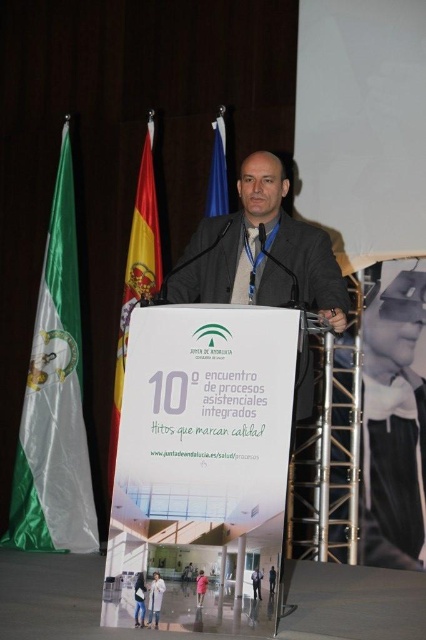
You are attending a formal event and notice a point marked at coordinates [218,170] on the image. Based on the scene description, what object is located at this point?

The point at coordinates [218,170] corresponds to the blue fabric flag at upper center.

In the scene shown: You are an event photographer positioned at the front of the stage. You need to capture a clear shot of both the green satin flag at left and the red fabric flag at upper left. Which flag should you adjust your camera focus on first to ensure clarity?

The green satin flag at left is closer to the viewer than the red fabric flag at upper left, so you should focus on the green satin flag at left first to ensure clarity.